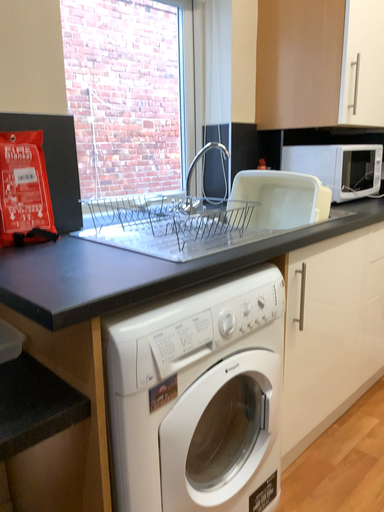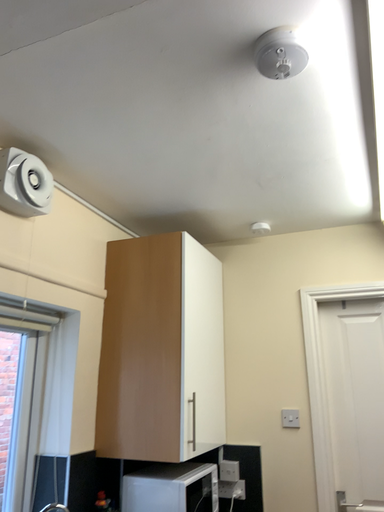
Question: How did the camera likely rotate when shooting the video?

Choices:
 (A) rotated left
 (B) rotated right

Answer: (B)